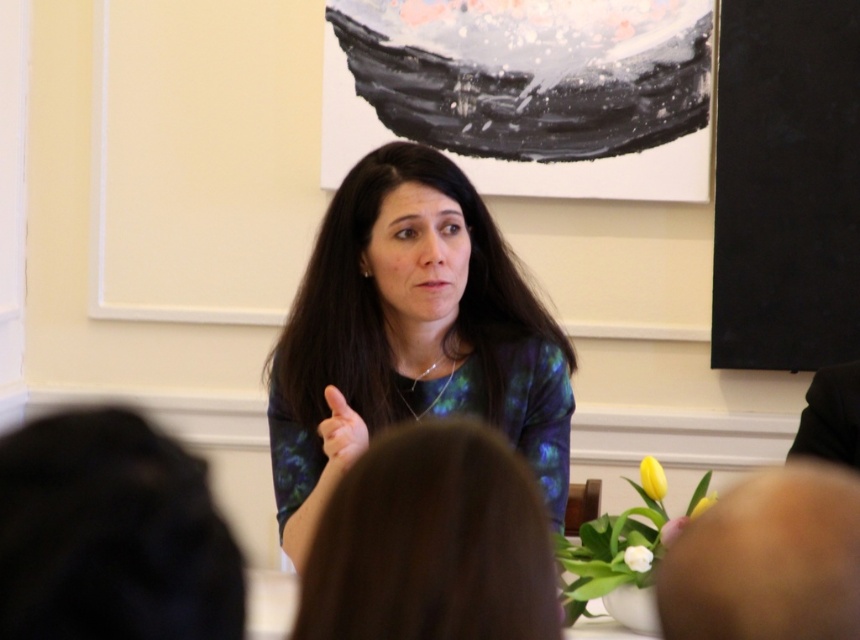
Question: Is blue printed shirt at center smaller than shiny blue dress at center?

Choices:
 (A) no
 (B) yes

Answer: (A)

Question: Which point is closer to the camera?

Choices:
 (A) blue printed shirt at center
 (B) shiny blue dress at center

Answer: (B)

Question: Can you confirm if blue printed shirt at center is bigger than shiny blue dress at center?

Choices:
 (A) yes
 (B) no

Answer: (A)

Question: Considering the relative positions of blue printed shirt at center and shiny blue dress at center in the image provided, where is blue printed shirt at center located with respect to shiny blue dress at center?

Choices:
 (A) below
 (B) above

Answer: (B)

Question: Which point is closer to the camera?

Choices:
 (A) (538, 493)
 (B) (452, 193)

Answer: (A)